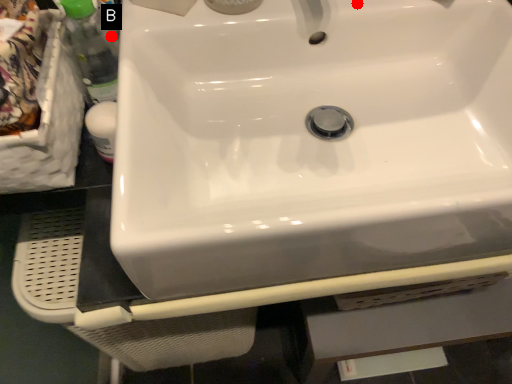
Question: Two points are circled on the image, labeled by A and B beside each circle. Which of the following is the closest to the observer?

Choices:
 (A) A is closer
 (B) B is closer

Answer: (A)